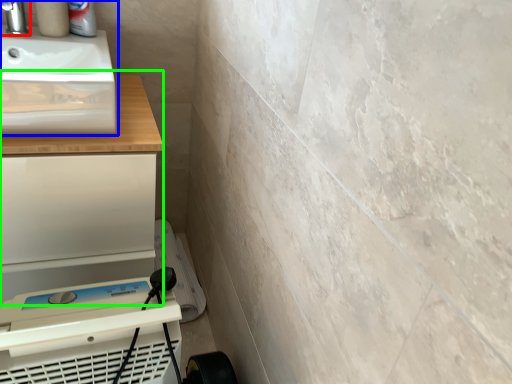
Question: Estimate the real-world distances between objects in this image. Which object is farther from tap (highlighted by a red box), sink (highlighted by a blue box) or counter (highlighted by a green box)?

Choices:
 (A) sink
 (B) counter

Answer: (B)